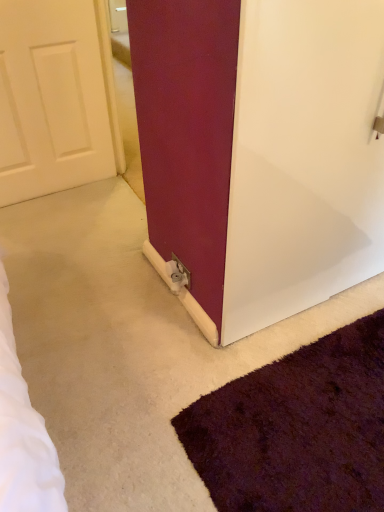
Question: Is matte white door at center at the left side of metallic silver outlet at lower center?

Choices:
 (A) yes
 (B) no

Answer: (B)

Question: Is matte white door at center completely or partially outside of metallic silver outlet at lower center?

Choices:
 (A) no
 (B) yes

Answer: (B)

Question: Considering the relative positions of matte white door at center and metallic silver outlet at lower center in the image provided, is matte white door at center behind metallic silver outlet at lower center?

Choices:
 (A) no
 (B) yes

Answer: (A)

Question: Is matte white door at center to the right of metallic silver outlet at lower center from the viewer's perspective?

Choices:
 (A) no
 (B) yes

Answer: (B)

Question: Is the position of matte white door at center less distant than that of metallic silver outlet at lower center?

Choices:
 (A) no
 (B) yes

Answer: (B)

Question: Is matte white door at center in contact with metallic silver outlet at lower center?

Choices:
 (A) no
 (B) yes

Answer: (A)

Question: Does metallic silver outlet at lower center come in front of matte white door at center?

Choices:
 (A) yes
 (B) no

Answer: (B)

Question: Is metallic silver outlet at lower center oriented towards matte white door at center?

Choices:
 (A) no
 (B) yes

Answer: (A)

Question: Is metallic silver outlet at lower center positioned far away from matte white door at center?

Choices:
 (A) yes
 (B) no

Answer: (B)

Question: Is metallic silver outlet at lower center shorter than matte white door at center?

Choices:
 (A) yes
 (B) no

Answer: (A)

Question: Is metallic silver outlet at lower center completely or partially outside of matte white door at center?

Choices:
 (A) no
 (B) yes

Answer: (B)

Question: Is matte white door at center at the back of metallic silver outlet at lower center?

Choices:
 (A) yes
 (B) no

Answer: (A)

Question: In terms of height, does metallic silver outlet at lower center look taller or shorter compared to matte white door at center?

Choices:
 (A) short
 (B) tall

Answer: (A)